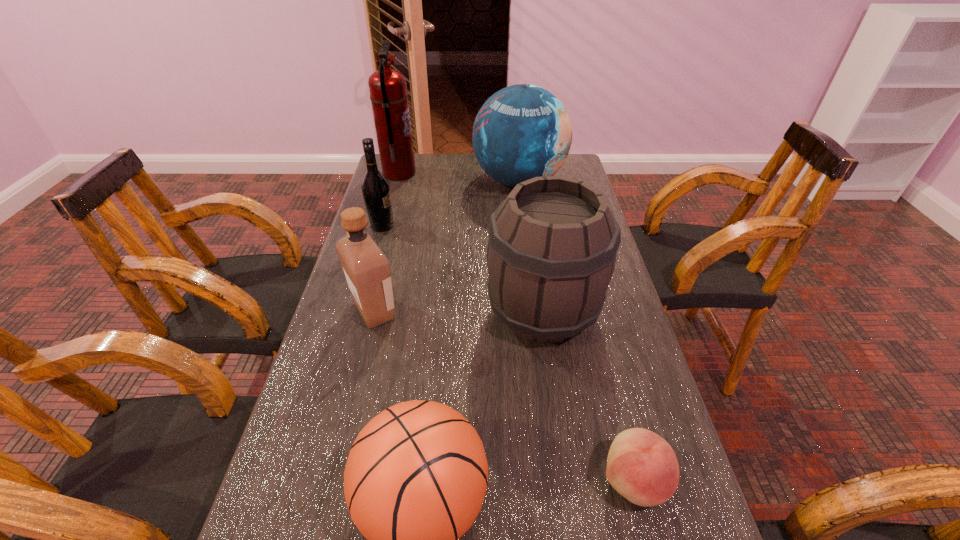
Find the location of a particular element. vacant area in the image that satisfies the following two spatial constraints: 1. on the front-facing side of the liquor; 2. on the right side of the peach is located at coordinates (333, 480).